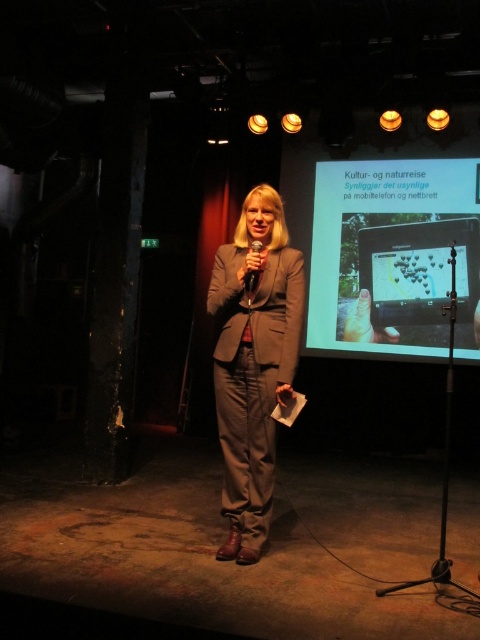
Looking at this image, you are an event organizer who needs to ensure that the presenter can move freely during her talk. Based on the image, which object is positioned closer to the front of the stage, the matte gray suit at center or the black plastic microphone at center?

The matte gray suit at center is closer to the viewer than the black plastic microphone at center, so the presenter can move freely as her suit is positioned closer to the front of the stage.

What is the position of the matte plastic projector screen at upper right relative to the matte gray suit at center?

The matte plastic projector screen at upper right is located above the matte gray suit at center.

Based on the scene description, can you determine which object is larger between the matte plastic projector screen at upper right and the matte gray suit at center?

The matte plastic projector screen at upper right is bigger than the matte gray suit at center according to the description.